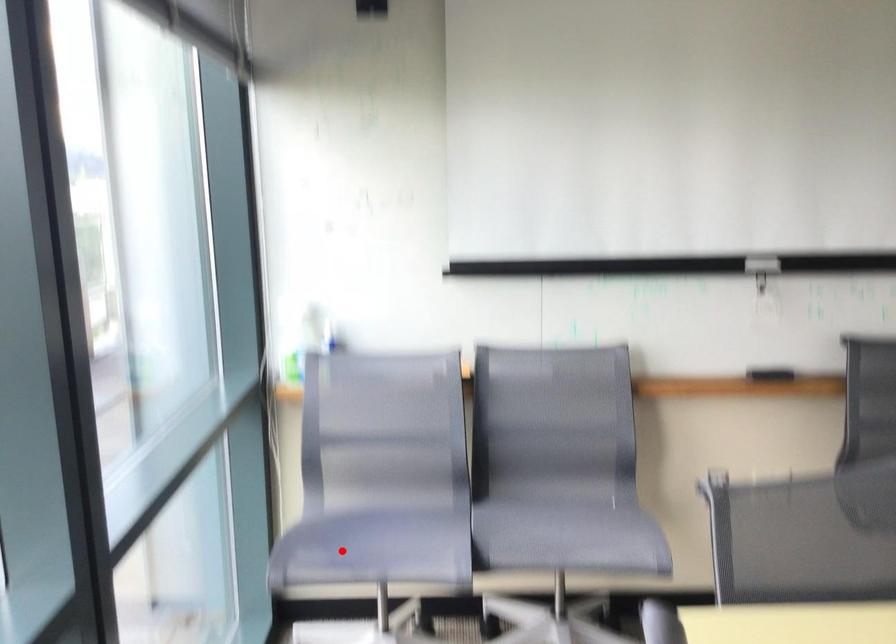
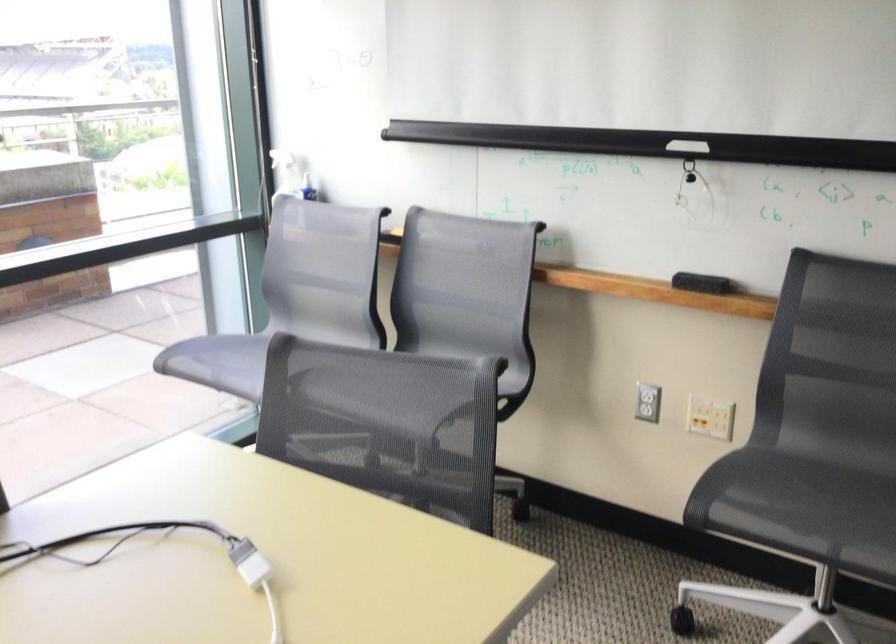
The point at the highlighted location is marked in the first image. Where is the corresponding point in the second image?

(219, 362)